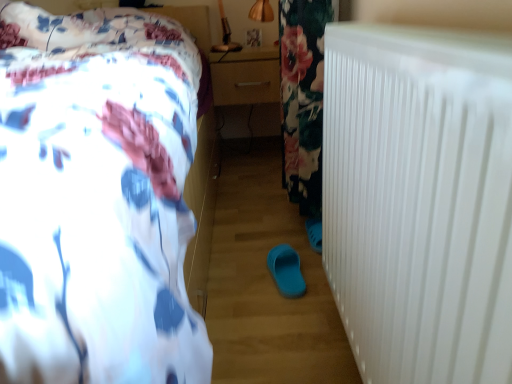
Question: Is point (62, 74) positioned closer to the camera than point (489, 291)?

Choices:
 (A) farther
 (B) closer

Answer: (A)

Question: From a real-world perspective, is white floral bedspread at upper left above or below white plastic radiator at right?

Choices:
 (A) below
 (B) above

Answer: (B)

Question: Based on their relative distances, which object is nearer to the matte wood drawer at center?

Choices:
 (A) white floral bedspread at upper left
 (B) blue rubber slipper at center
 (C) white plastic radiator at right

Answer: (A)

Question: Estimate the real-world distances between objects in this image. Which object is farther from the white floral bedspread at upper left?

Choices:
 (A) matte wood drawer at center
 (B) blue rubber slipper at center
 (C) white plastic radiator at right

Answer: (A)